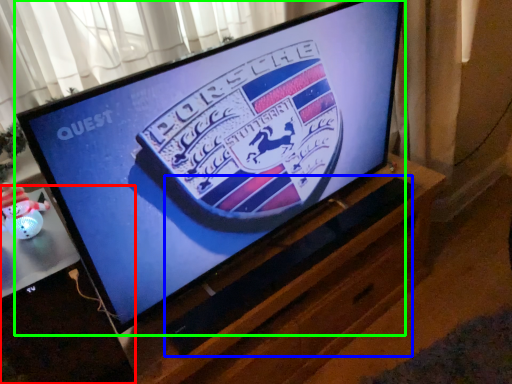
Question: Considering the real-world distances, which object is farthest from desktop (highlighted by a red box)? speaker (highlighted by a blue box) or television (highlighted by a green box)?

Choices:
 (A) speaker
 (B) television

Answer: (A)